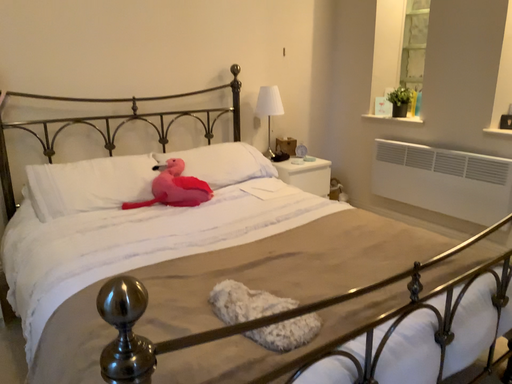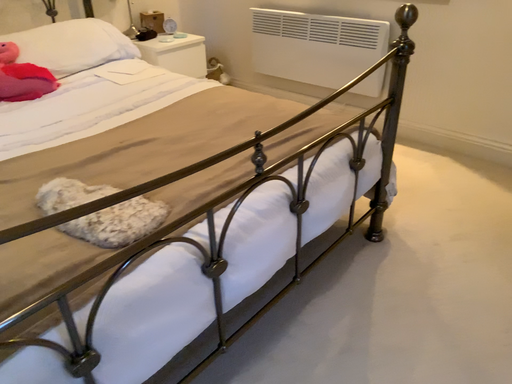
Question: Which way did the camera rotate in the video?

Choices:
 (A) rotated left
 (B) rotated right

Answer: (B)